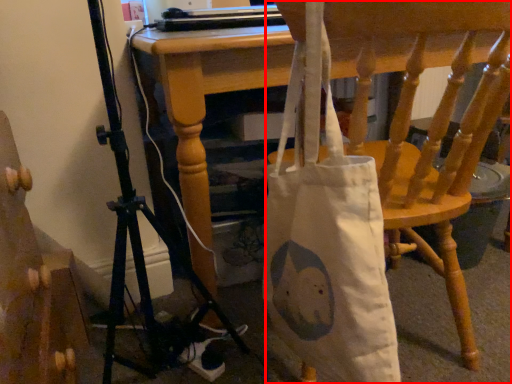
Question: Observing the image, what is the correct spatial positioning of chair (annotated by the red box) in reference to furniture?

Choices:
 (A) left
 (B) right

Answer: (B)